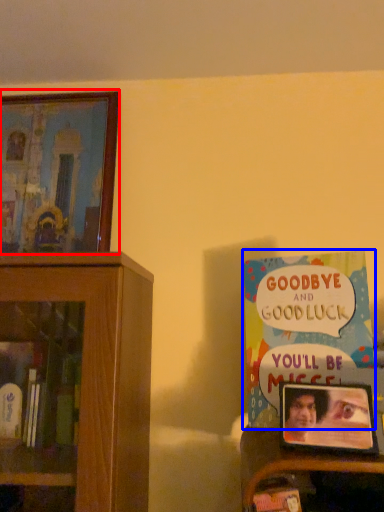
Question: Which object appears closest to the camera in this image, picture frame (highlighted by a red box) or book (highlighted by a blue box)?

Choices:
 (A) picture frame
 (B) book

Answer: (B)